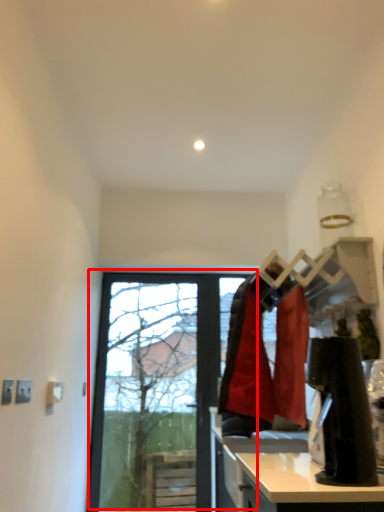
Question: Where is window (annotated by the red box) located in relation to counter top in the image?

Choices:
 (A) right
 (B) left

Answer: (B)